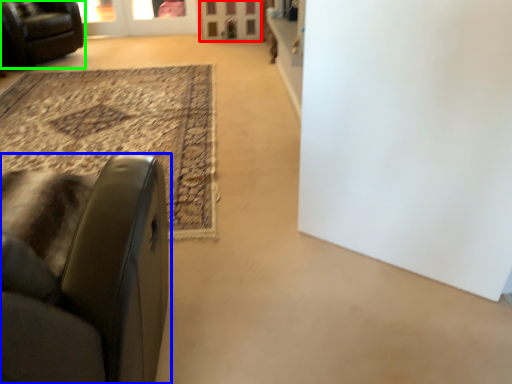
Question: Based on their relative distances, which object is farther from screen door (highlighted by a red box)? Choose from chair (highlighted by a blue box) and chair (highlighted by a green box).

Choices:
 (A) chair
 (B) chair

Answer: (A)